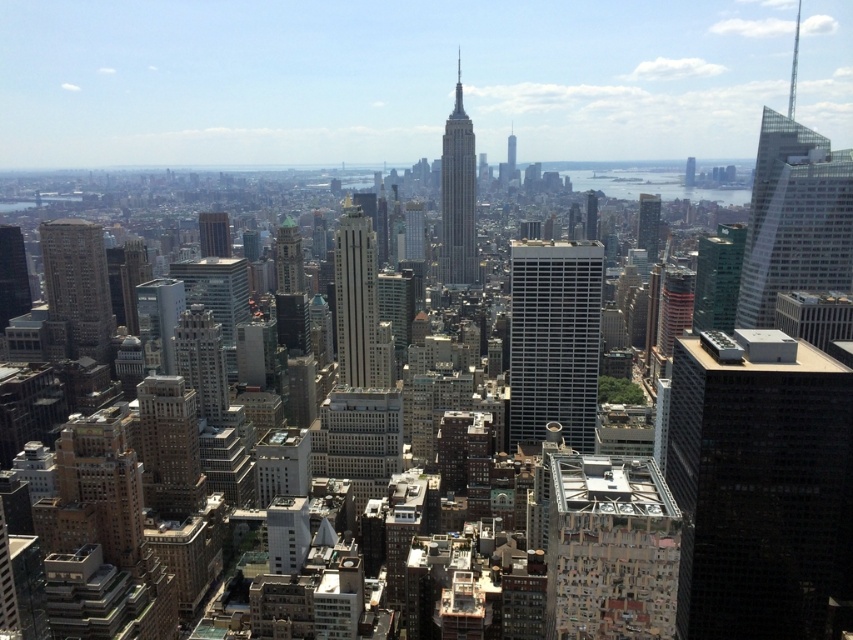
Looking at this image, does gray concrete skyscraper at center have a lesser width compared to silver glass skyscraper at center?

Incorrect, gray concrete skyscraper at center's width is not less than silver glass skyscraper at center's.

Measure the distance between point (x=595, y=372) and camera.

2094.60 feet

Is point (540, 296) farther from viewer compared to point (354, 371)?

That is True.

Locate an element on the screen. The height and width of the screenshot is (640, 853). gray concrete skyscraper at center is located at coordinates (554, 339).

Does silver glass skyscraper at center appear on the right side of glassy reflective skyscraper at center-right?

No, silver glass skyscraper at center is not to the right of glassy reflective skyscraper at center-right.

Is silver glass skyscraper at center wider than glassy reflective skyscraper at center-right?

Yes.

Is point (373, 246) closer to viewer compared to point (654, 211)?

Yes, it is.

Identify the location of silver glass skyscraper at center. (357, 298).

Between textured concrete building at center and matte gray skyscraper at center-left, which one appears on the left side from the viewer's perspective?

From the viewer's perspective, matte gray skyscraper at center-left appears more on the left side.

Who is more distant from viewer, [637,636] or [212,253]?

Point [212,253]

Image resolution: width=853 pixels, height=640 pixels. In order to click on textured concrete building at center in this screenshot , I will do `click(610, 548)`.